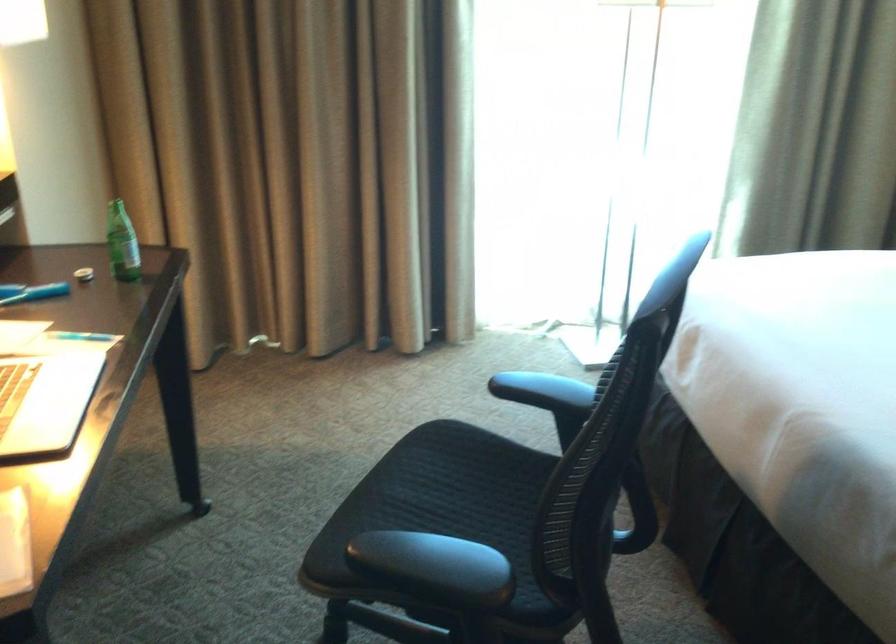
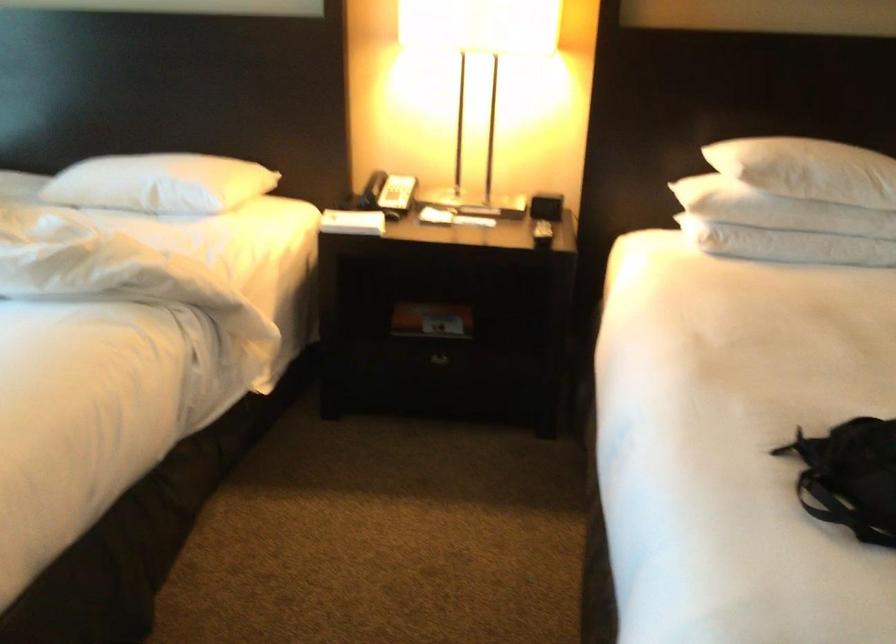
Question: The images are taken continuously from a first-person perspective. In which direction is your viewpoint rotating?

Choices:
 (A) Left
 (B) Right
 (C) Up
 (D) Down

Answer: (B)